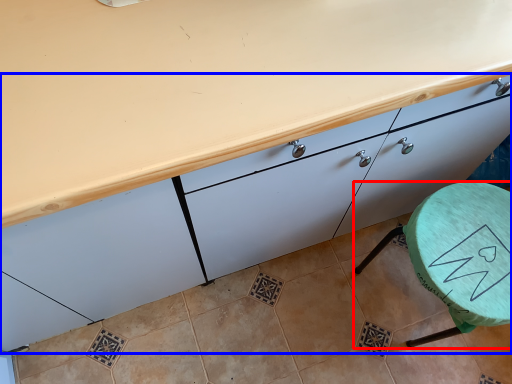
Question: Among these objects, which one is farthest to the camera, furniture (highlighted by a red box) or cabinetry (highlighted by a blue box)?

Choices:
 (A) furniture
 (B) cabinetry

Answer: (A)